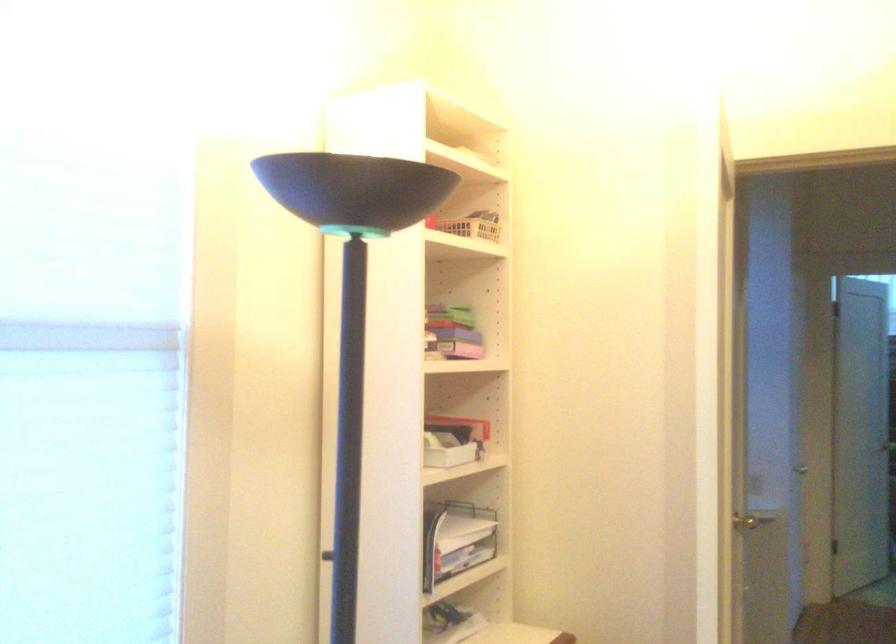
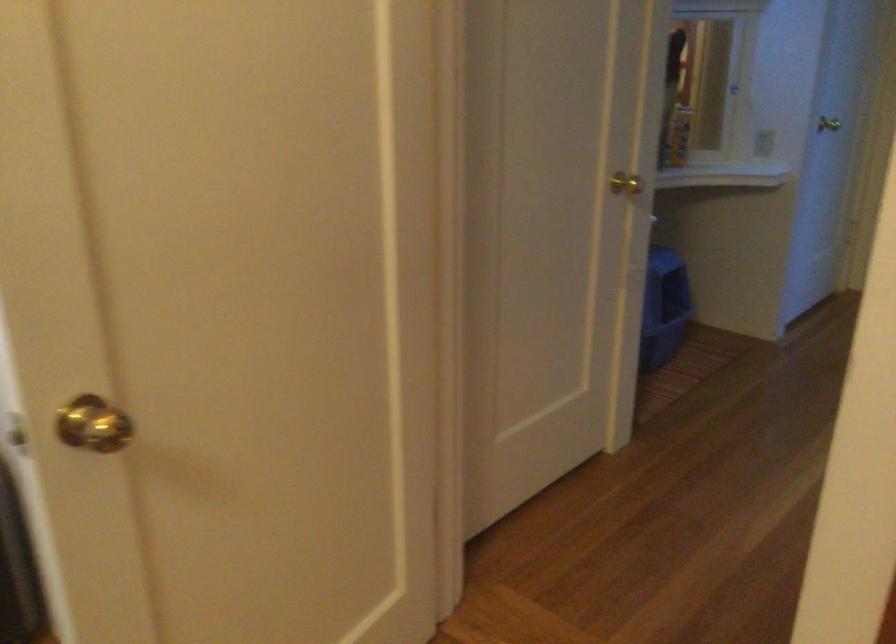
Where in the second image is the point corresponding to (x=751, y=522) from the first image?

(625, 184)